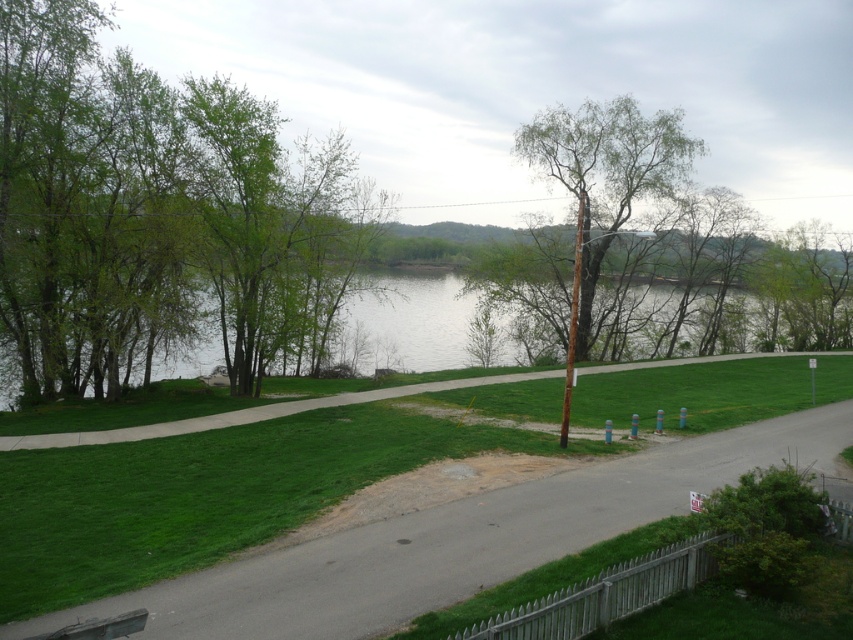
You are a hiker standing on the gray asphalt road at center. You want to take a photo of the green leafy tree at center. Which direction should you face to capture the tree in your view?

Since the gray asphalt road at center is not as tall as the green leafy tree at center, you should face towards the tree to capture it in your view.

You are standing at the point with coordinates point (117, 332) and want to walk to the point with coordinates point (608, 125). According to the scene description, which direction should you face to walk directly towards your destination?

You should face towards the upper left direction to walk directly from point (117, 332) to point (608, 125) since the destination is located in that direction relative to the starting point.